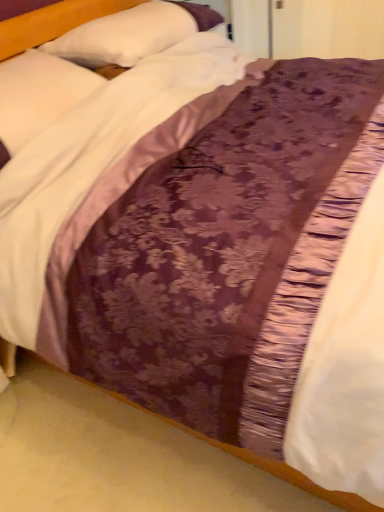
Question: In the image, is white satin pillow at upper left, which is the 2th pillow from top to bottom, on the left side or the right side of white satin pillow at upper center, the second pillow ordered from the bottom?

Choices:
 (A) right
 (B) left

Answer: (B)

Question: From a real-world perspective, is white satin pillow at upper left, which is the 2th pillow from top to bottom, above or below white satin pillow at upper center, placed as the first pillow when sorted from top to bottom?

Choices:
 (A) below
 (B) above

Answer: (A)

Question: Based on their sizes in the image, would you say white satin pillow at upper left, which is counted as the 1th pillow, starting from the bottom, is bigger or smaller than white satin pillow at upper center, the second pillow ordered from the bottom?

Choices:
 (A) big
 (B) small

Answer: (B)

Question: From the image's perspective, is white satin pillow at upper center, placed as the first pillow when sorted from top to bottom, above or below white satin pillow at upper left, which is counted as the 1th pillow, starting from the bottom?

Choices:
 (A) below
 (B) above

Answer: (B)

Question: Is white satin pillow at upper center, the second pillow ordered from the bottom, in front of or behind white satin pillow at upper left, which is counted as the 1th pillow, starting from the bottom, in the image?

Choices:
 (A) front
 (B) behind

Answer: (B)

Question: Choose the correct answer: Is white satin pillow at upper center, placed as the first pillow when sorted from top to bottom, inside white satin pillow at upper left, which is counted as the 1th pillow, starting from the bottom, or outside it?

Choices:
 (A) inside
 (B) outside

Answer: (B)

Question: Visually, is white satin pillow at upper center, placed as the first pillow when sorted from top to bottom, positioned to the left or to the right of white satin pillow at upper left, which is counted as the 1th pillow, starting from the bottom?

Choices:
 (A) left
 (B) right

Answer: (B)